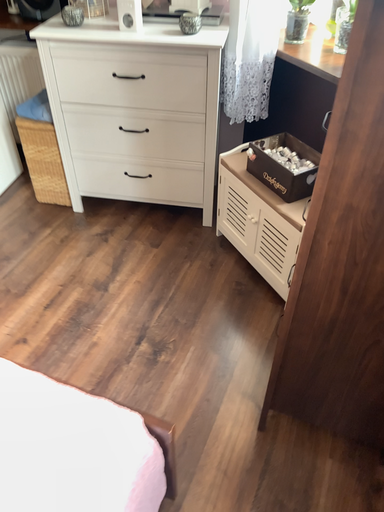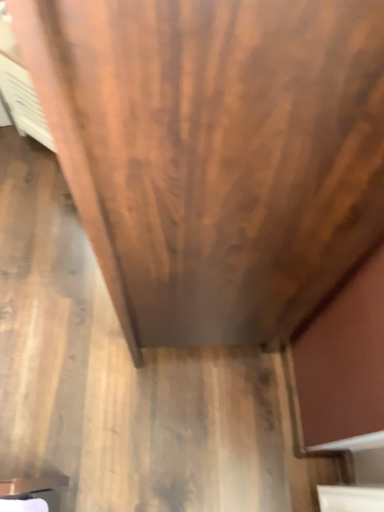
Question: How did the camera likely rotate when shooting the video?

Choices:
 (A) rotated downward
 (B) rotated upward

Answer: (A)